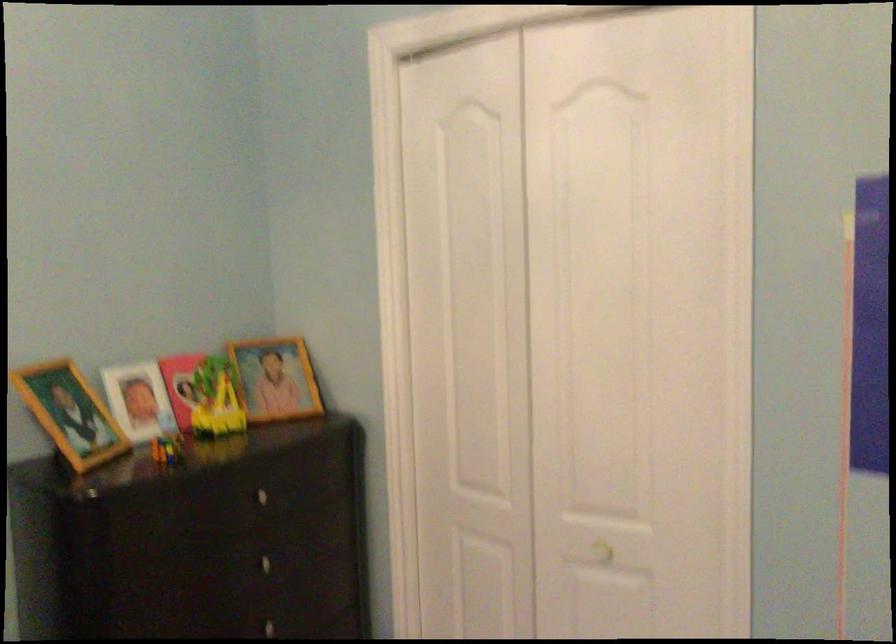
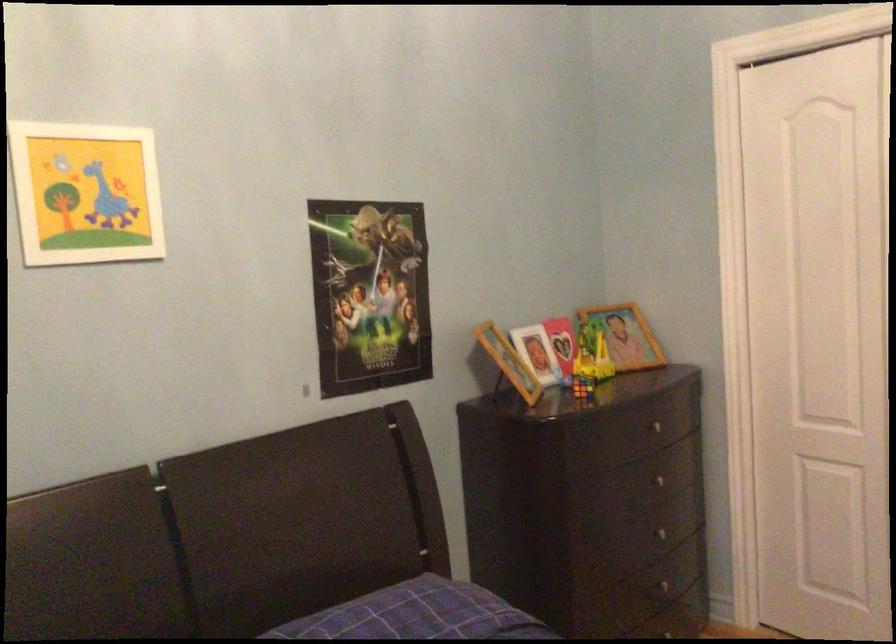
Question: I am providing you with two images of the same scene from different viewpoints. Which of the following objects are not visible in image2?

Choices:
 (A) red heart object
 (B) Rubik's cube
 (C) dark drawer knob
 (D) none of these

Answer: (D)